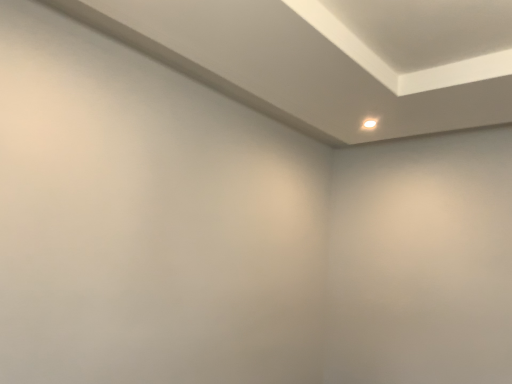
This screenshot has height=384, width=512. Find the location of `white glossy light at upper right`. white glossy light at upper right is located at coordinates (369, 123).

The width and height of the screenshot is (512, 384). Describe the element at coordinates (369, 123) in the screenshot. I see `white glossy light at upper right` at that location.

What are the coordinates of `white glossy light at upper right` in the screenshot? It's located at (369, 123).